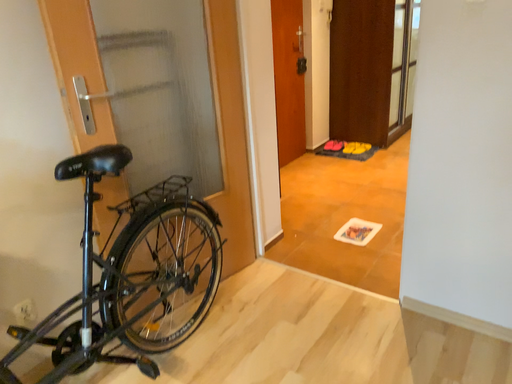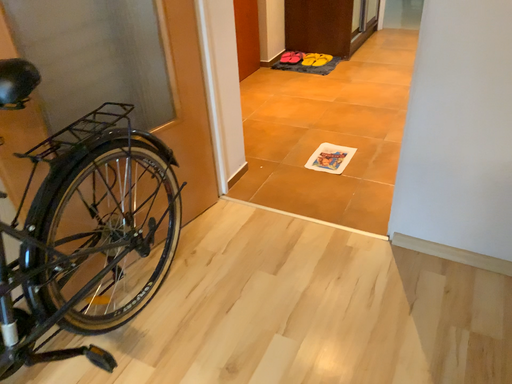
Question: How did the camera likely rotate when shooting the video?

Choices:
 (A) rotated right
 (B) rotated left

Answer: (A)